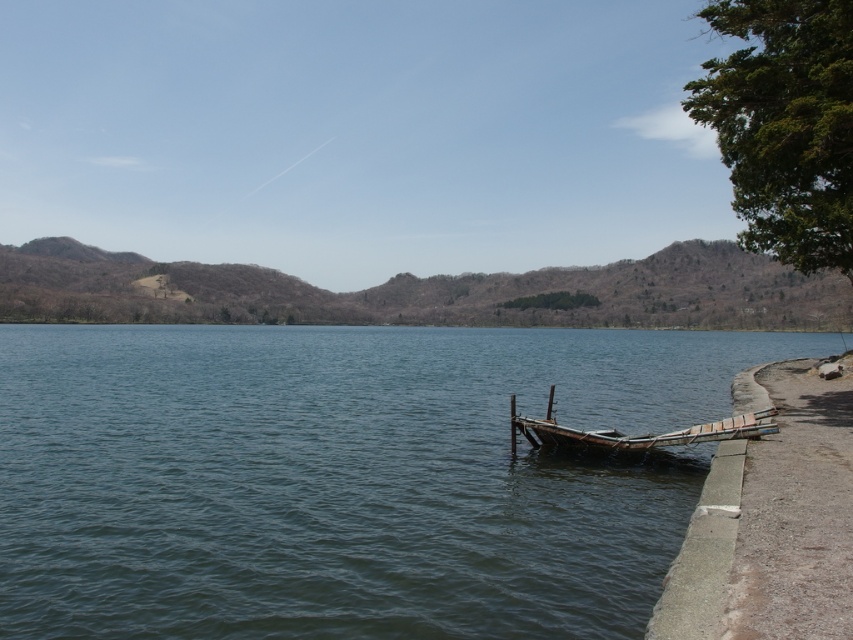
You are standing at the edge of the lake and want to determine which of the two points, point (660, 531) or point (549, 419), is closer to you. Based on the scene, which point is nearer?

Point (660, 531) is closer to the viewer than point (549, 419).

You are a photographer planning to capture the blue water at lower left and the wooden boat at lower right in a single frame. Based on the scene, which object will occupy more space in your photo?

The blue water at lower left will occupy more space in the photo because it has a larger size compared to the wooden boat at lower right according to the description.

You are standing at the point marked as point (345, 477) in the image. What object are you currently standing on?

You are standing on the blue water at lower left located at point (345, 477).